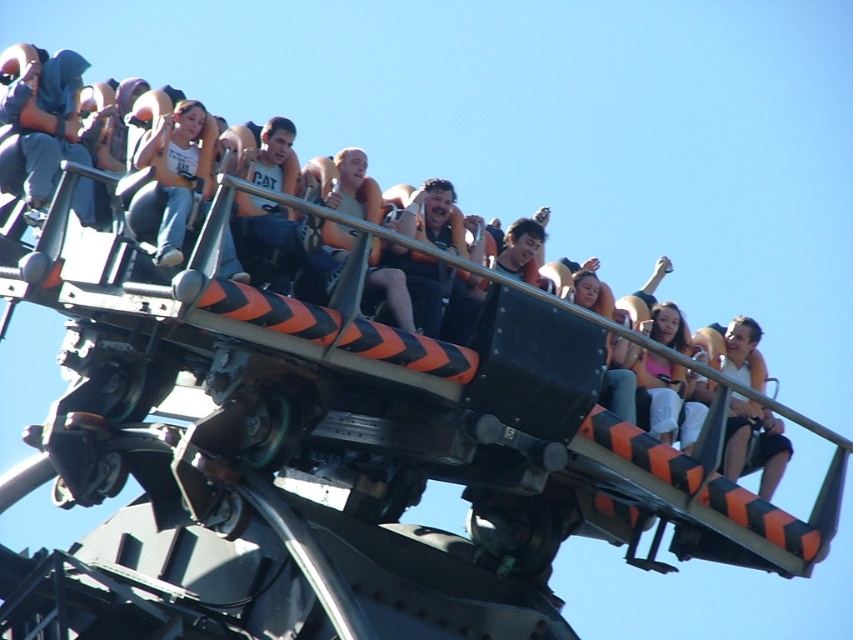
You are a photographer standing at the origin point of the coordinate system. You see a point at coordinates point (178, 170). Can you tell me what object this point is located on?

The point (178, 170) is located on the matte white tank top at center.

You are a photographer at the amusement park and want to capture a closeup of the matte white tank top at center and the pink fabric at center. Since the camera can only focus on one object at a time, which one should you choose to ensure it fills the frame more?

The matte white tank top at center is bigger than the pink fabric at center, so you should choose to focus on the matte white tank top at center to ensure it fills the frame more.

You are a photographer trying to capture a clear photo of the matte white tank top at center and the white matte shirt at upper right. However, you notice that one of them is blocking the other. Which one is blocking the other?

The matte white tank top at center is blocking the white matte shirt at upper right because it is positioned in front of it.